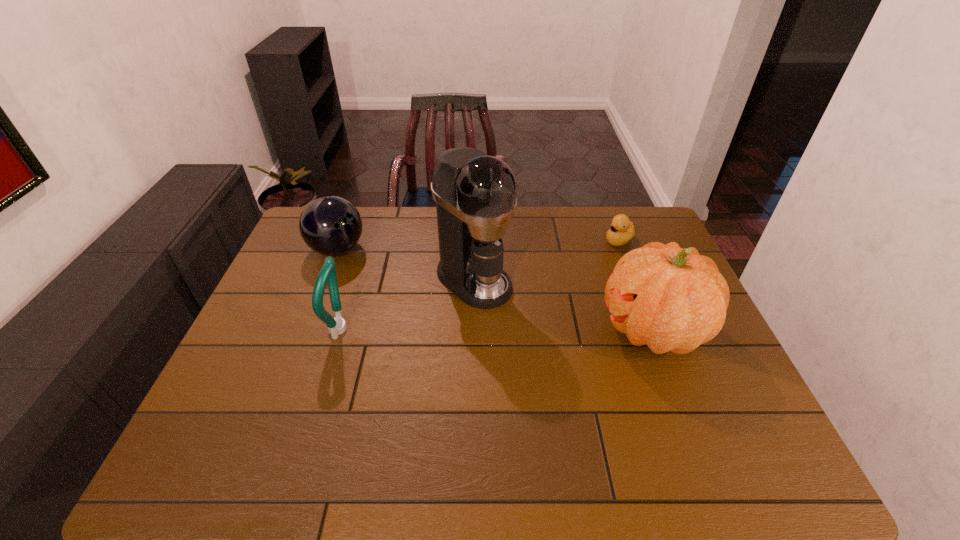
What are the coordinates of `free space on the desktop that is between the bottle opener and the pumpkin and is positioned facing forward on the duckling` in the screenshot? It's located at (492, 329).

Identify the location of free space on the desktop that is between the third tallest object and the second tallest object and is positioned on the side of the bowling ball with the finger holes. The width and height of the screenshot is (960, 540). (486, 329).

Where is `free space on the desktop that is between the third shortest object and the pumpkin and is positioned place cup under the spout of the coffee maker`? This screenshot has width=960, height=540. free space on the desktop that is between the third shortest object and the pumpkin and is positioned place cup under the spout of the coffee maker is located at coordinates (534, 329).